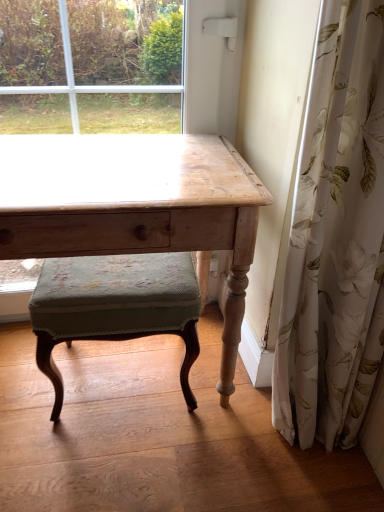
Question: In terms of height, does velvet green cushioned stool at center look taller or shorter compared to white floral fabric at right?

Choices:
 (A) tall
 (B) short

Answer: (B)

Question: Does point (180, 329) appear closer or farther from the camera than point (324, 389)?

Choices:
 (A) closer
 (B) farther

Answer: (A)

Question: Estimate the real-world distances between objects in this image. Which object is closer to the wooden table at center?

Choices:
 (A) wooden desk at center
 (B) velvet green cushioned stool at center
 (C) white floral fabric at right

Answer: (B)

Question: Which of these objects is positioned farthest from the white floral fabric at right?

Choices:
 (A) wooden table at center
 (B) velvet green cushioned stool at center
 (C) wooden desk at center

Answer: (C)